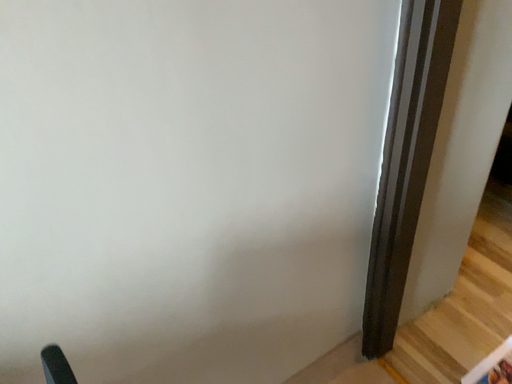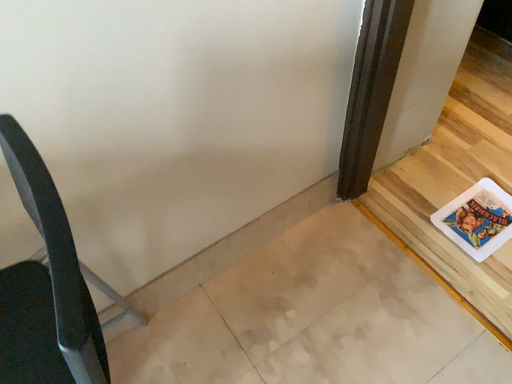
Question: How did the camera likely rotate when shooting the video?

Choices:
 (A) rotated upward
 (B) rotated downward

Answer: (B)